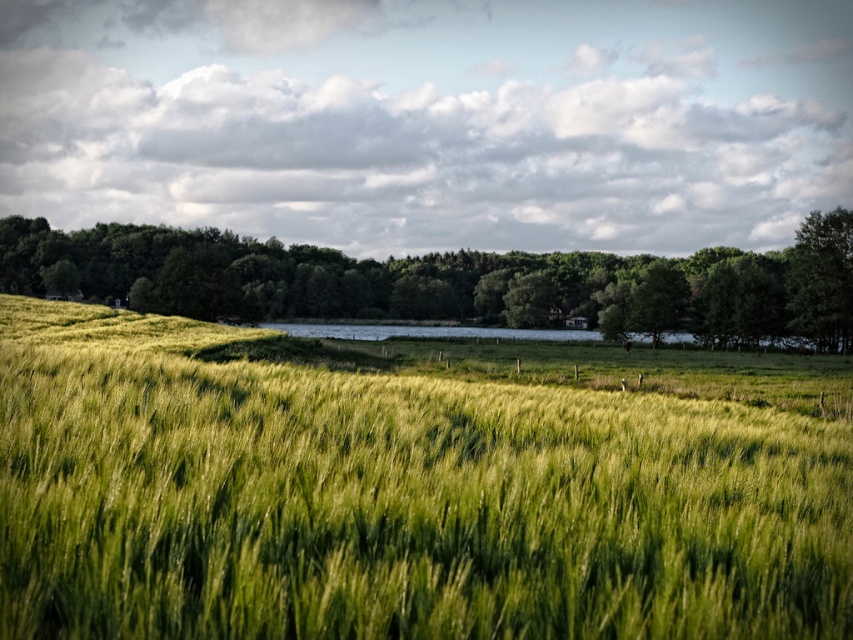
Who is more distant from viewer, [589,532] or [705,292]?

Point [705,292]

Can you confirm if green grassy wheat field at center is positioned to the left of green leafy tree at center?

No, green grassy wheat field at center is not to the left of green leafy tree at center.

Is point (848, 580) positioned before point (148, 300)?

Yes.

I want to click on green grassy wheat field at center, so click(396, 502).

Is point (265, 589) farther from viewer compared to point (802, 241)?

That is False.

Who is taller, green grassy wheat field at center or green leafy tree at upper right?

green leafy tree at upper right

Between point (51, 577) and point (849, 237), which one is positioned behind?

The point (849, 237) is more distant.

Identify the location of green grassy wheat field at center. (396, 502).

The width and height of the screenshot is (853, 640). What do you see at coordinates (451, 282) in the screenshot?
I see `green leafy tree at center` at bounding box center [451, 282].

Is point (358, 269) less distant than point (848, 227)?

No, (358, 269) is behind (848, 227).

Which is behind, point (90, 282) or point (820, 237)?

The point (90, 282) is behind.

Locate an element on the screen. The image size is (853, 640). green leafy tree at center is located at coordinates (451, 282).